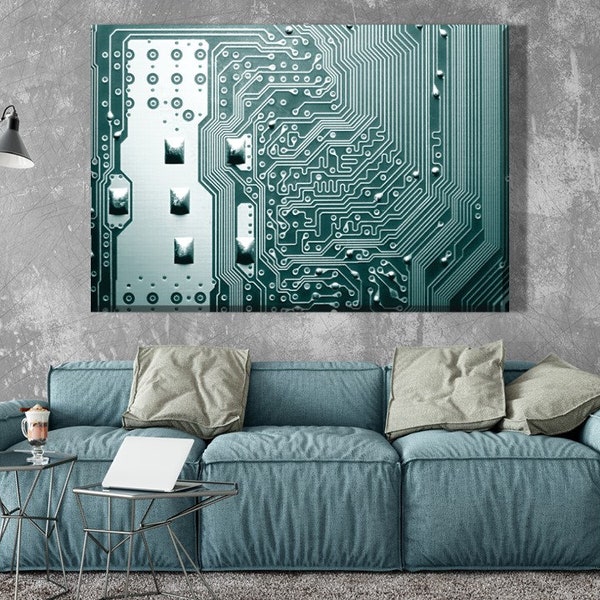
You are a GUI agent. You are given a task and a screenshot of the screen. Output one action in this format:
    pyautogui.click(x=<x>, y=<y>)
    Task: Click on the pillows
    Image resolution: width=600 pixels, height=600 pixels.
    Given the screenshot: What is the action you would take?
    pyautogui.click(x=207, y=367), pyautogui.click(x=447, y=395), pyautogui.click(x=562, y=410)